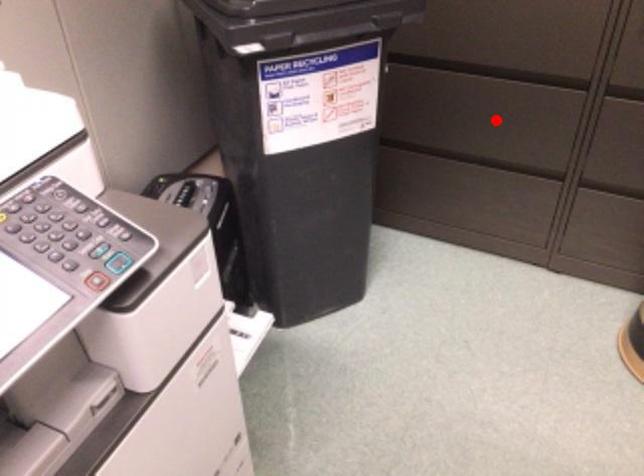
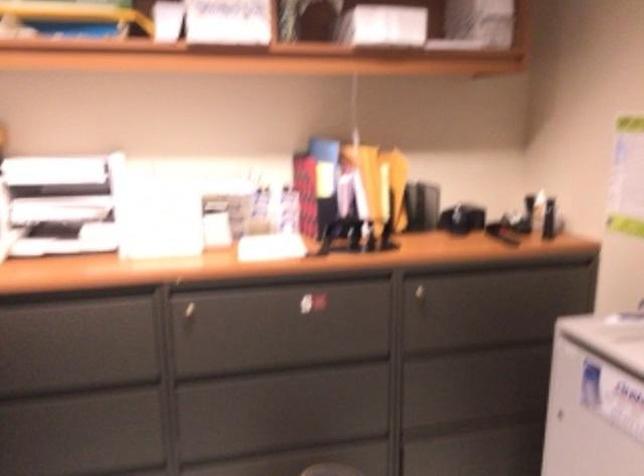
Where in the second image is the point corresponding to the highlighted location from the first image?

(89, 441)